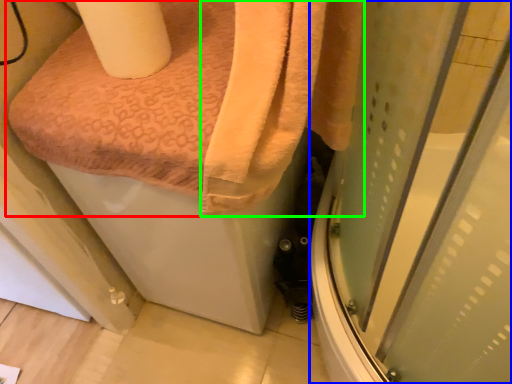
Question: Which object is positioned closest to towel (highlighted by a red box)? Select from screen door (highlighted by a blue box) and bath towel (highlighted by a green box).

Choices:
 (A) screen door
 (B) bath towel

Answer: (B)